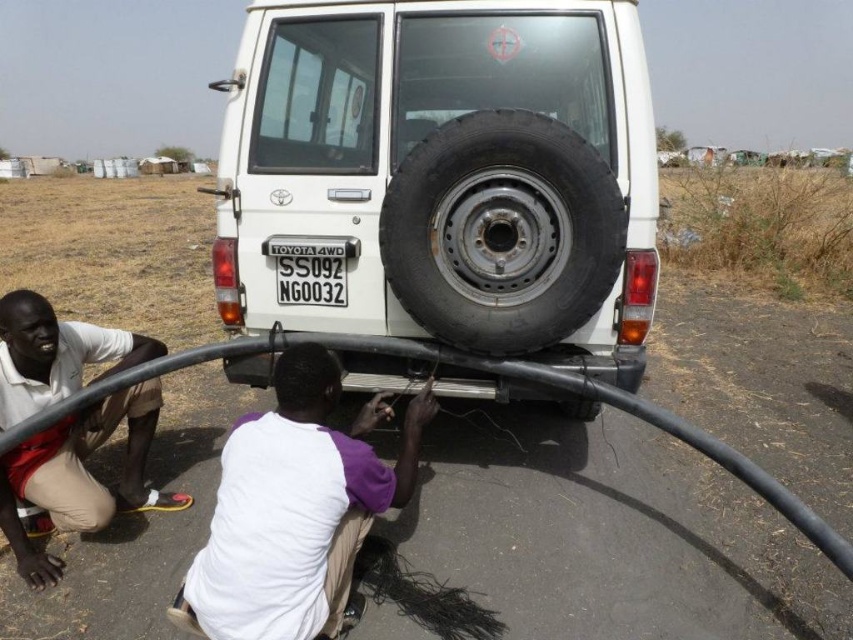
You are standing at the origin point of the coordinate system. You need to walk to the light beige shorts at lower left. What are the coordinates you need to move to?

The coordinates to move to are approximately 0.745 in the x direction and 0.094 in the y direction.